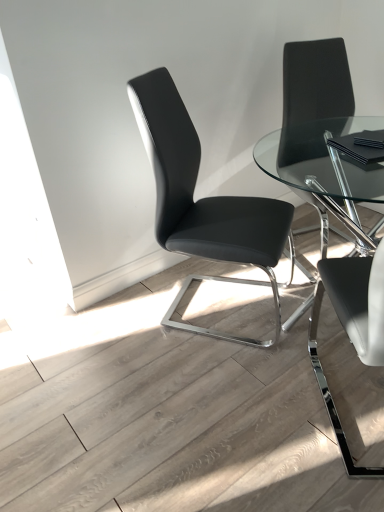
Question: From a real-world perspective, relative to black leather chair at center, the 3th chair from the right, is black leather chair at right, which is counted as the second chair, starting from the right, vertically above or below?

Choices:
 (A) below
 (B) above

Answer: (B)

Question: Do you think black leather chair at right, the second chair in the left-to-right sequence, is within black leather chair at center, the 3th chair from the right, or outside of it?

Choices:
 (A) outside
 (B) inside

Answer: (A)

Question: Based on their relative distances, which object is nearer to the black leather chair at right, the second chair in the left-to-right sequence?

Choices:
 (A) black leather chair at center, which ranks as the 1th chair in left-to-right order
 (B) black leather chair at upper right, which appears as the first chair when viewed from the right

Answer: (A)

Question: Which object is the closest to the black leather chair at upper right, which appears as the first chair when viewed from the right?

Choices:
 (A) black leather chair at right, which is counted as the second chair, starting from the right
 (B) black leather chair at center, the 3th chair from the right

Answer: (B)